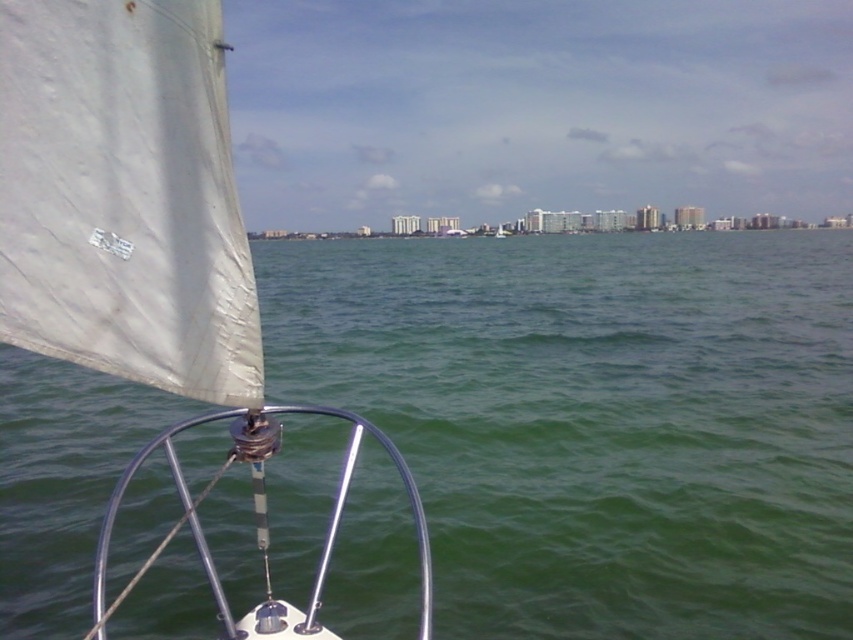
You are a sailor navigating a boat and need to adjust the white matte sail at center. Considering the position of the green water at center, which object is closer to you as you stand on the deck?

The green water at center is closer to you because the white matte sail at center is positioned behind it.

You are standing on the deck of the sailboat and looking out towards the city skyline. There is a point marked at coordinates (596, 419) which is located on the green water at center. If you were to throw a small floating marker towards that point, would it land in the water or on the sailboat?

The point marked at coordinates (596, 419) is located on the green water at center, so the floating marker would land in the water.

You are a sailor trying to navigate between the green water at center and the white matte sail at center. Since you need to choose the wider path, which one should you choose?

The green water at center has a larger width than the white matte sail at center, so you should choose the green water at center for the wider path.